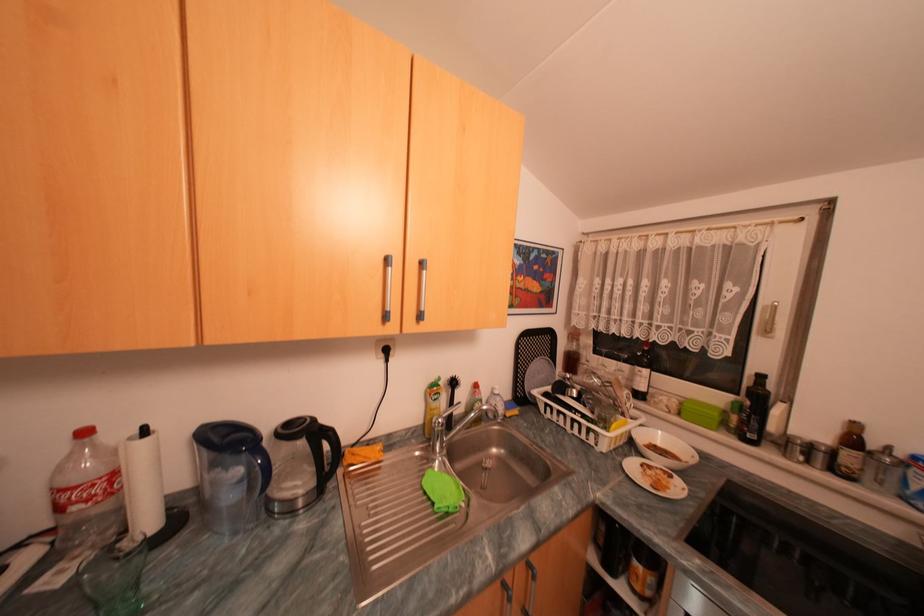
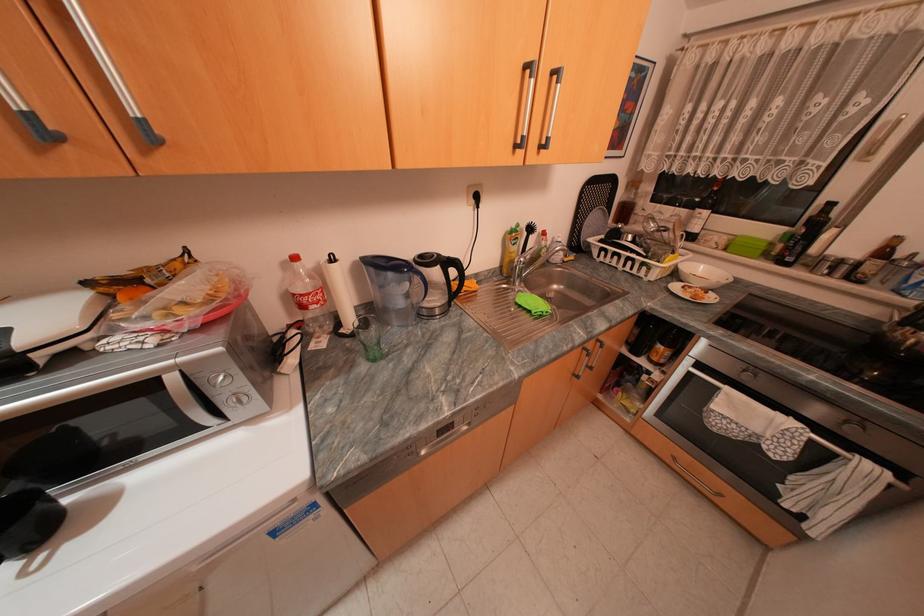
Where in the second image is the point corresponding to (x=98, y=500) from the first image?

(326, 302)